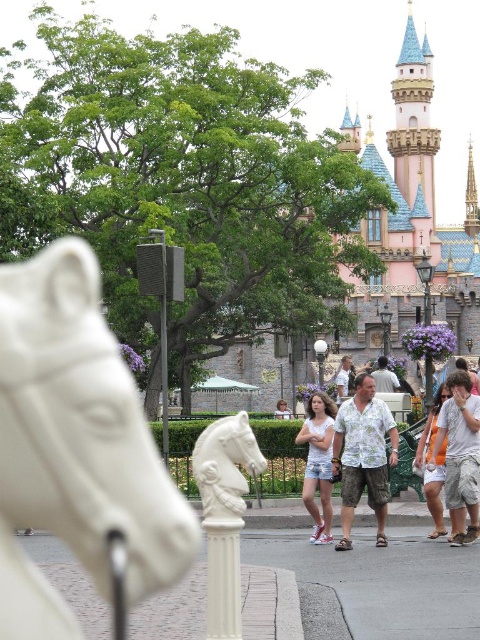
You are standing at the point marked by the coordinates (226,465) in the image. What object is located exactly at this point?

The point at (226,465) marks the location of the white marble horse head at center.

You are a photographer trying to capture both the hawaiian print shirt at center and the white cotton shirt at center in the same frame. Which shirt should you focus on to ensure both are in the frame without cropping?

The hawaiian print shirt at center is taller than the white cotton shirt at center, so focusing on the taller hawaiian print shirt at center will ensure both shirts are captured without cropping.

You are a photographer capturing a scene at the theme park. You notice two people wearing shirts in the center of the image. The first person is wearing a hawaiian print shirt at center, and the second is wearing a white cotton shirt at center. From your perspective, which shirt is located to the left?

The hawaiian print shirt at center is positioned on the left side of the white cotton shirt at center, so the Hawaiian print shirt is on the left.